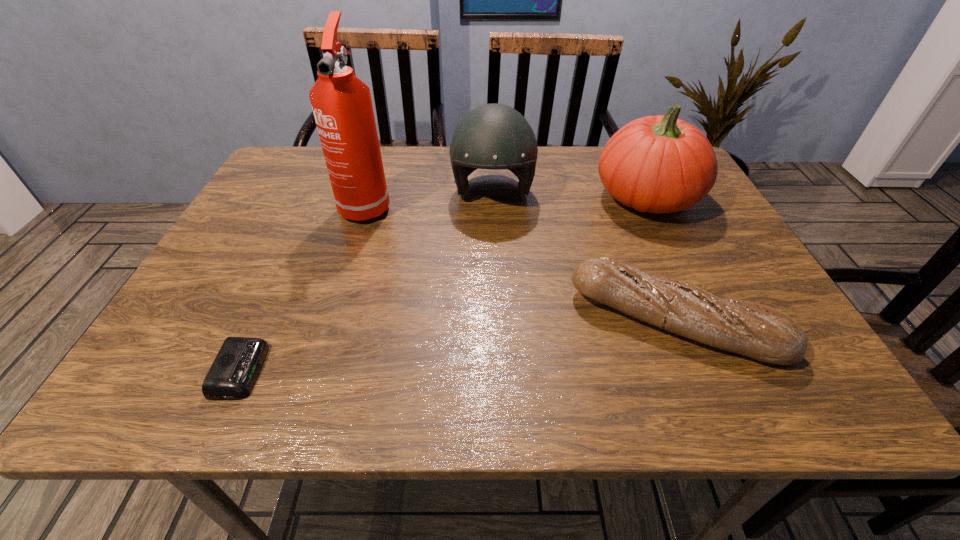
Find the location of a particular element. This screenshot has width=960, height=540. fire extinguisher is located at coordinates (342, 106).

The width and height of the screenshot is (960, 540). In order to click on the tallest object in this screenshot , I will do `click(342, 106)`.

At what (x,y) coordinates should I click in order to perform the action: click on pumpkin. Please return your answer as a coordinate pair (x, y). Looking at the image, I should click on click(658, 164).

The image size is (960, 540). I want to click on the third object from left to right, so click(493, 136).

Locate an element on the screen. the fourth tallest object is located at coordinates (760, 332).

Locate an element on the screen. The height and width of the screenshot is (540, 960). alarm clock is located at coordinates (234, 371).

Identify the location of the leftmost object. This screenshot has width=960, height=540. (234, 371).

Where is `free space located at the nozzle of the fire extinguisher`? This screenshot has height=540, width=960. free space located at the nozzle of the fire extinguisher is located at coordinates (348, 262).

Identify the location of free space located 0.160m on the left of the pumpkin. This screenshot has height=540, width=960. (532, 197).

I want to click on free space located at the face opening of the football helmet, so click(494, 234).